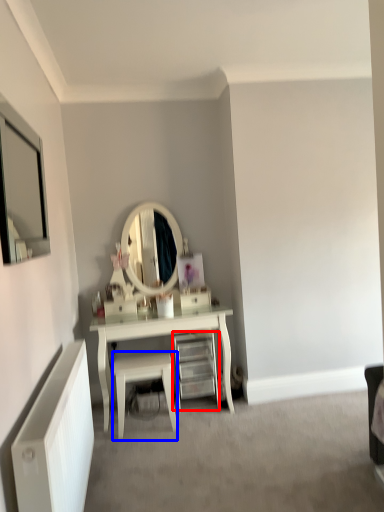
Question: Among these objects, which one is farthest to the camera, shelf (highlighted by a red box) or stool (highlighted by a blue box)?

Choices:
 (A) shelf
 (B) stool

Answer: (A)